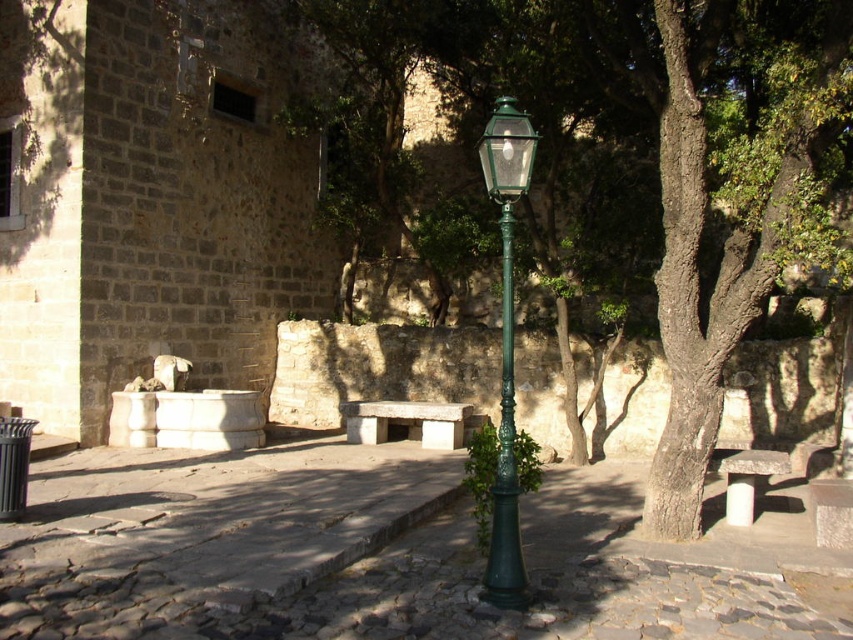
Question: Is the position of green textured tree at center less distant than that of green polished metal street light at center?

Choices:
 (A) no
 (B) yes

Answer: (A)

Question: Estimate the real-world distances between objects in this image. Which object is closer to the smooth stone bench at lower right?

Choices:
 (A) green polished metal street light at center
 (B) white stone bench at center
 (C) green textured tree at center

Answer: (A)

Question: Based on their relative distances, which object is nearer to the green polished metal street light at center?

Choices:
 (A) white stone bench at center
 (B) smooth stone bench at lower right
 (C) green textured tree at center

Answer: (A)

Question: Where is green textured tree at center located in relation to smooth stone bench at lower right in the image?

Choices:
 (A) right
 (B) left

Answer: (A)

Question: Can you confirm if green polished metal street light at center is positioned above smooth stone bench at lower right?

Choices:
 (A) yes
 (B) no

Answer: (A)

Question: Among these points, which one is nearest to the camera?

Choices:
 (A) (492, 490)
 (B) (579, 80)

Answer: (A)